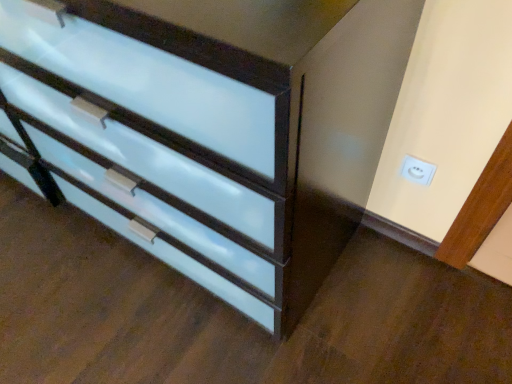
Question: From a real-world perspective, is matte white chest of drawers at lower left physically below white plastic electric outlet at upper right?

Choices:
 (A) no
 (B) yes

Answer: (A)

Question: From the image's perspective, is matte white chest of drawers at lower left above white plastic electric outlet at upper right?

Choices:
 (A) no
 (B) yes

Answer: (B)

Question: Is matte white chest of drawers at lower left at the left side of white plastic electric outlet at upper right?

Choices:
 (A) no
 (B) yes

Answer: (B)

Question: Can you confirm if matte white chest of drawers at lower left is shorter than white plastic electric outlet at upper right?

Choices:
 (A) no
 (B) yes

Answer: (A)

Question: Does matte white chest of drawers at lower left lie behind white plastic electric outlet at upper right?

Choices:
 (A) yes
 (B) no

Answer: (B)

Question: Can you confirm if matte white chest of drawers at lower left is positioned to the right of white plastic electric outlet at upper right?

Choices:
 (A) no
 (B) yes

Answer: (A)

Question: Can you confirm if white plastic electric outlet at upper right is bigger than matte white chest of drawers at lower left?

Choices:
 (A) no
 (B) yes

Answer: (A)

Question: Is white plastic electric outlet at upper right next to matte white chest of drawers at lower left?

Choices:
 (A) yes
 (B) no

Answer: (B)

Question: Considering the relative sizes of white plastic electric outlet at upper right and matte white chest of drawers at lower left in the image provided, is white plastic electric outlet at upper right shorter than matte white chest of drawers at lower left?

Choices:
 (A) no
 (B) yes

Answer: (B)

Question: Is white plastic electric outlet at upper right positioned beyond the bounds of matte white chest of drawers at lower left?

Choices:
 (A) no
 (B) yes

Answer: (B)

Question: Are white plastic electric outlet at upper right and matte white chest of drawers at lower left located far from each other?

Choices:
 (A) no
 (B) yes

Answer: (A)

Question: From the image's perspective, is white plastic electric outlet at upper right on matte white chest of drawers at lower left?

Choices:
 (A) no
 (B) yes

Answer: (A)

Question: Is point (402, 160) positioned closer to the camera than point (168, 253)?

Choices:
 (A) farther
 (B) closer

Answer: (B)